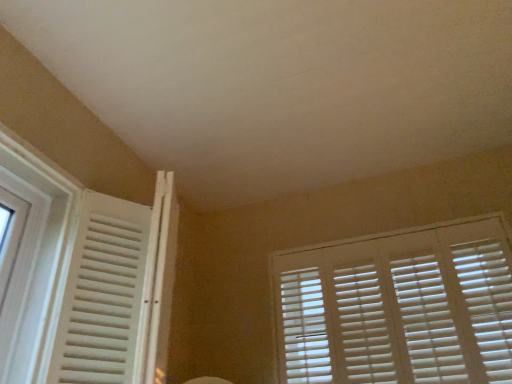
Question: Does white matte window blind at upper right lie behind white wooden window at left?

Choices:
 (A) yes
 (B) no

Answer: (A)

Question: Is white matte window blind at upper right closer to the viewer compared to white wooden window at left?

Choices:
 (A) no
 (B) yes

Answer: (A)

Question: Is white matte window blind at upper right oriented away from white wooden window at left?

Choices:
 (A) yes
 (B) no

Answer: (B)

Question: Is white matte window blind at upper right thinner than white wooden window at left?

Choices:
 (A) yes
 (B) no

Answer: (A)

Question: From a real-world perspective, is white matte window blind at upper right positioned over white wooden window at left based on gravity?

Choices:
 (A) no
 (B) yes

Answer: (B)

Question: Can you see white matte window blind at upper right touching white wooden window at left?

Choices:
 (A) yes
 (B) no

Answer: (B)

Question: Does white wooden window at left appear on the left side of white matte window blind at upper right?

Choices:
 (A) no
 (B) yes

Answer: (B)

Question: Is white wooden window at left directly adjacent to white matte window blind at upper right?

Choices:
 (A) yes
 (B) no

Answer: (B)

Question: From a real-world perspective, is white wooden window at left located beneath white matte window blind at upper right?

Choices:
 (A) yes
 (B) no

Answer: (A)

Question: Can white matte window blind at upper right be found inside white wooden window at left?

Choices:
 (A) yes
 (B) no

Answer: (B)

Question: Does white wooden window at left have a smaller size compared to white matte window blind at upper right?

Choices:
 (A) no
 (B) yes

Answer: (A)

Question: From the image's perspective, is white wooden window at left over white matte window blind at upper right?

Choices:
 (A) no
 (B) yes

Answer: (B)

Question: From the image's perspective, is white wooden window at left located above or below white matte window blind at upper right?

Choices:
 (A) above
 (B) below

Answer: (A)